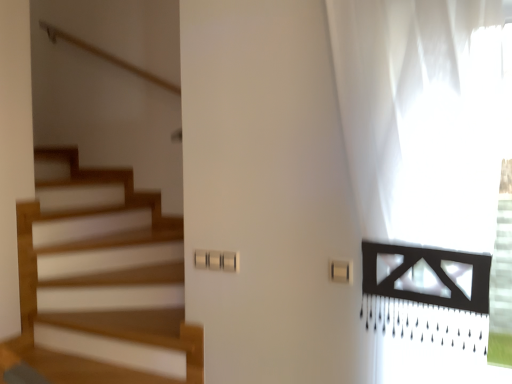
Question: Considering the relative positions of white sheer curtain at right and white plastic light switch at center in the image provided, is white sheer curtain at right behind white plastic light switch at center?

Choices:
 (A) yes
 (B) no

Answer: (B)

Question: From the image's perspective, is white sheer curtain at right on top of white plastic light switch at center?

Choices:
 (A) no
 (B) yes

Answer: (B)

Question: Is white sheer curtain at right at the right side of white plastic light switch at center?

Choices:
 (A) no
 (B) yes

Answer: (B)

Question: Is white sheer curtain at right smaller than white plastic light switch at center?

Choices:
 (A) no
 (B) yes

Answer: (A)

Question: Is white sheer curtain at right looking in the opposite direction of white plastic light switch at center?

Choices:
 (A) yes
 (B) no

Answer: (A)

Question: From a real-world perspective, is white sheer curtain at right on top of white plastic light switch at center?

Choices:
 (A) no
 (B) yes

Answer: (B)

Question: Would you consider white plastic light switch at center to be distant from white sheer curtain at right?

Choices:
 (A) yes
 (B) no

Answer: (B)

Question: From the image's perspective, does white plastic light switch at center appear lower than white sheer curtain at right?

Choices:
 (A) no
 (B) yes

Answer: (B)

Question: Is white plastic light switch at center aimed at white sheer curtain at right?

Choices:
 (A) no
 (B) yes

Answer: (B)

Question: Does white plastic light switch at center appear on the left side of white sheer curtain at right?

Choices:
 (A) yes
 (B) no

Answer: (A)

Question: Can you confirm if white plastic light switch at center is bigger than white sheer curtain at right?

Choices:
 (A) yes
 (B) no

Answer: (B)

Question: Does white plastic light switch at center have a greater height compared to white sheer curtain at right?

Choices:
 (A) yes
 (B) no

Answer: (B)

Question: In the image, is white sheer curtain at right on the left side or the right side of white plastic light switch at center?

Choices:
 (A) right
 (B) left

Answer: (A)